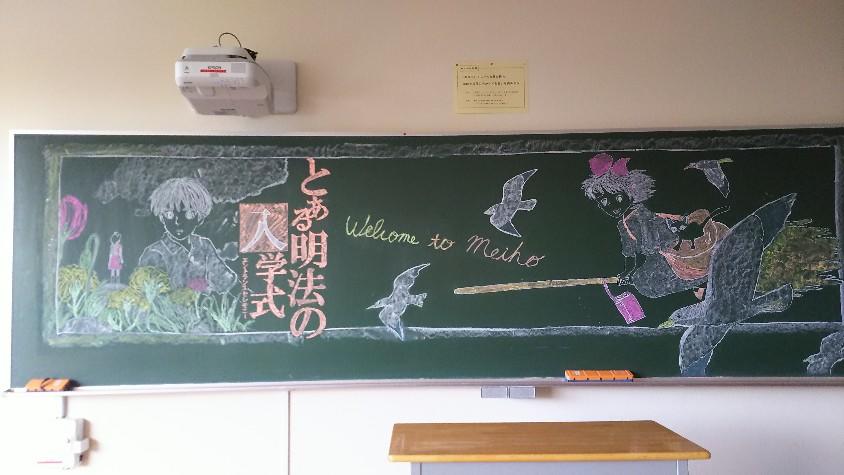
Locate an element on the screen. The width and height of the screenshot is (844, 475). art is located at coordinates (663, 257).